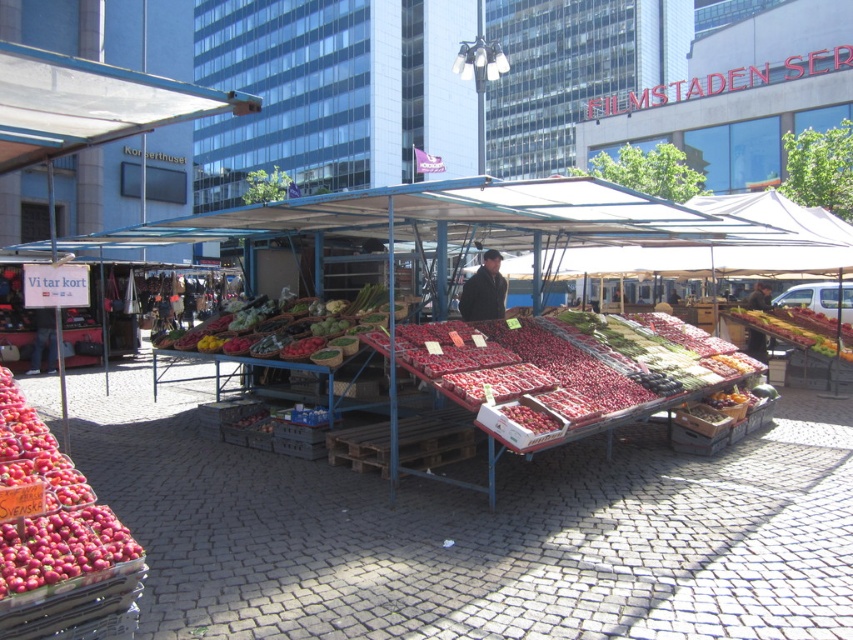
From the picture: You are a customer at the market and want to know which item is taller between the shiny plastic strawberries at center and the shiny red tomatoes at center. Can you tell me which one is taller?

The shiny plastic strawberries at center are much taller than the shiny red tomatoes at center according to the description.